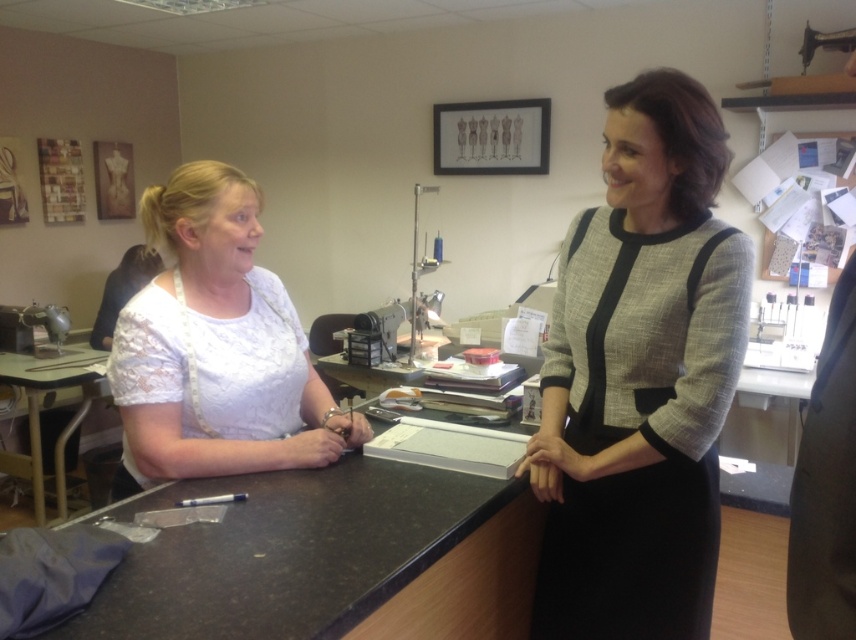
From the picture: Does white lace blouse at left have a smaller size compared to light brown wooden table at lower left?

Indeed, white lace blouse at left has a smaller size compared to light brown wooden table at lower left.

Which is more to the right, white lace blouse at left or light brown wooden table at lower left?

white lace blouse at left

This screenshot has width=856, height=640. I want to click on white lace blouse at left, so click(x=217, y=348).

Measure the distance from matte gray dress at center to white lace blouse at left.

matte gray dress at center is 24.86 inches from white lace blouse at left.

Between point (640, 588) and point (175, 442), which one is positioned in front?

Positioned in front is point (640, 588).

Does point (694, 161) come in front of point (241, 428)?

Yes.

Locate an element on the screen. The height and width of the screenshot is (640, 856). matte gray dress at center is located at coordinates (640, 378).

Does matte gray dress at center come in front of light brown wooden table at lower left?

Yes, matte gray dress at center is closer to the viewer.

Is point (610, 193) positioned behind point (22, 378)?

No, it is in front of (22, 378).

At what (x,y) coordinates should I click in order to perform the action: click on matte gray dress at center. Please return your answer as a coordinate pair (x, y). The width and height of the screenshot is (856, 640). Looking at the image, I should click on (640, 378).

This screenshot has width=856, height=640. Identify the location of matte gray dress at center. (640, 378).